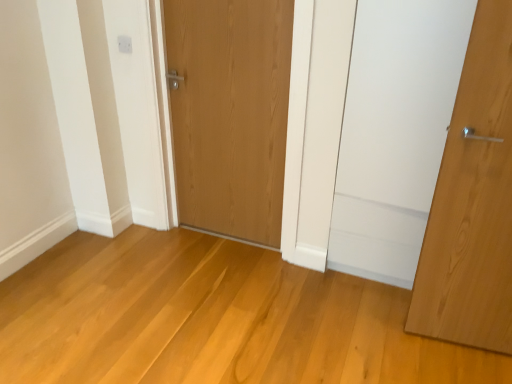
Find the location of a particular element. The height and width of the screenshot is (384, 512). free space in front of wooden door at center, which is the second door from right to left is located at coordinates (212, 294).